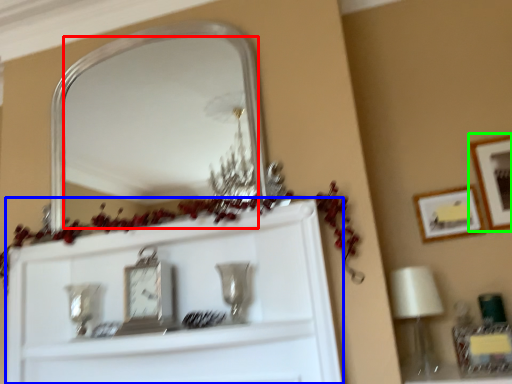
Question: Which object is the closest to the mirror (highlighted by a red box)? Choose among these: cabinet (highlighted by a blue box) or picture frame (highlighted by a green box).

Choices:
 (A) cabinet
 (B) picture frame

Answer: (A)